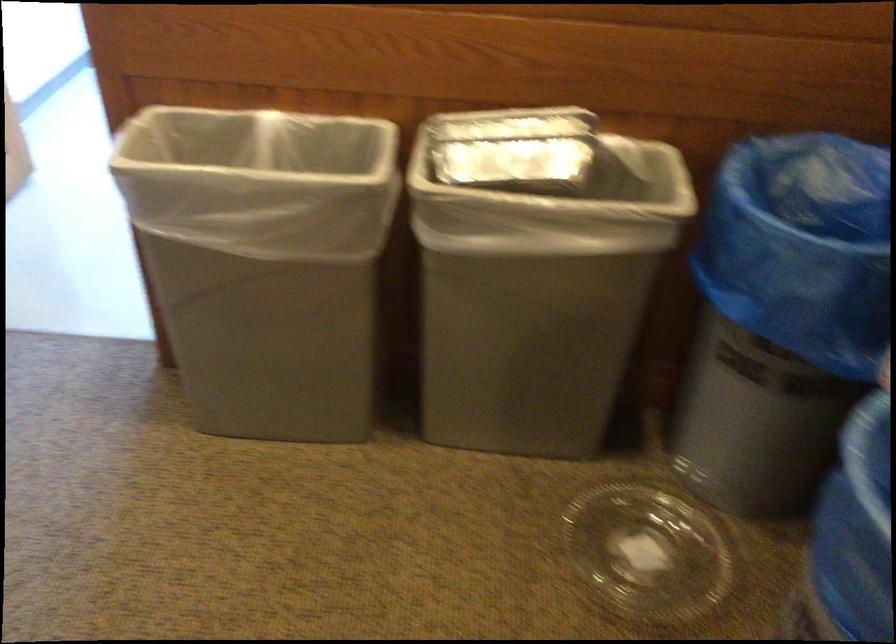
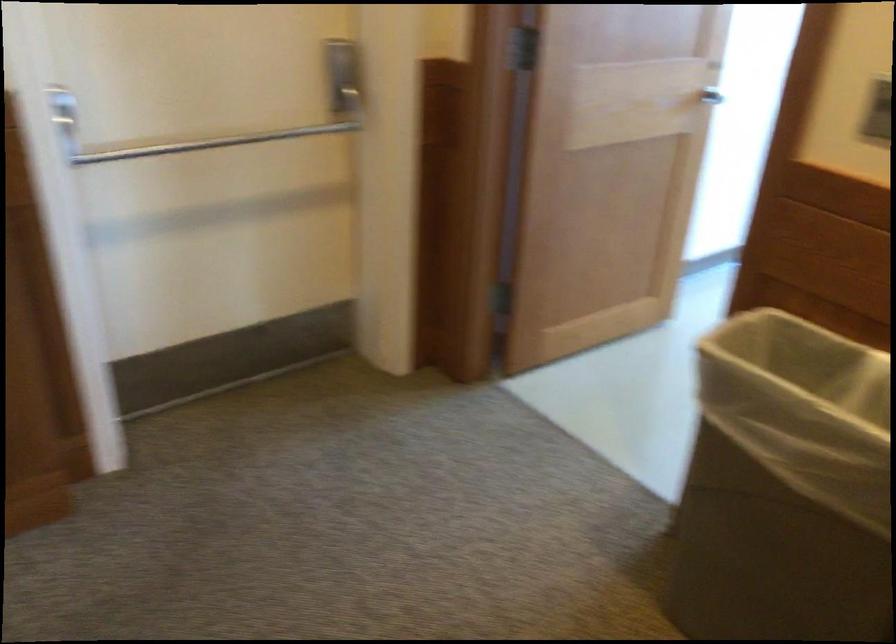
Question: The first image is from the beginning of the video and the second image is from the end. How did the camera likely rotate when shooting the video?

Choices:
 (A) Left
 (B) Right
 (C) Up
 (D) Down

Answer: (A)